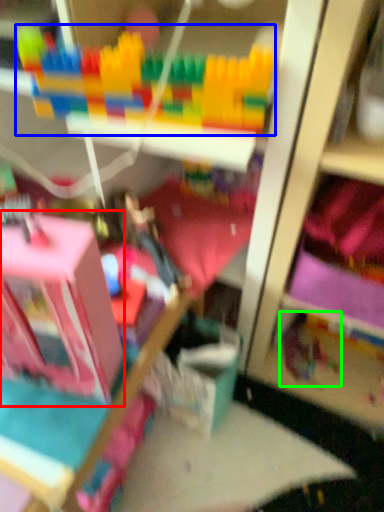
Question: Considering the real-world distances, which object is farthest from toy (highlighted by a red box)? toy (highlighted by a blue box) or toy (highlighted by a green box)?

Choices:
 (A) toy
 (B) toy

Answer: (B)